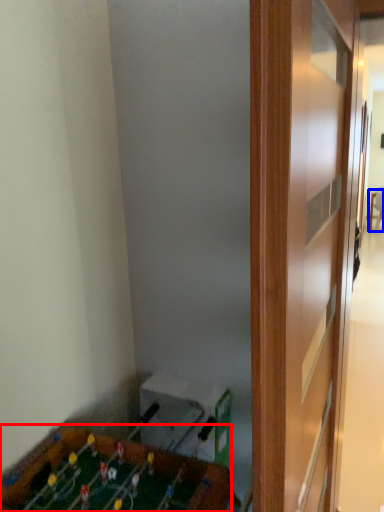
Question: Among these objects, which one is nearest to the camera, furniture (highlighted by a red box) or table (highlighted by a blue box)?

Choices:
 (A) furniture
 (B) table

Answer: (A)